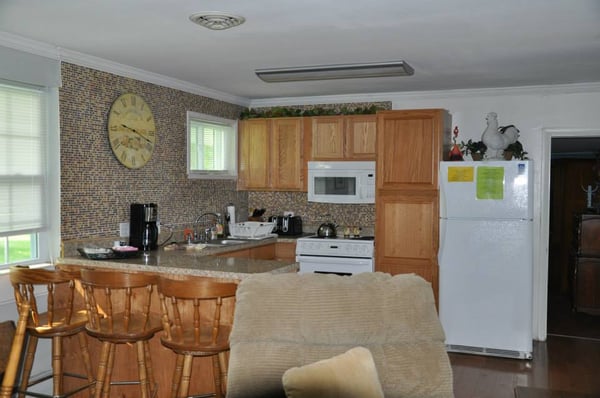
Locate an element on the screen. The width and height of the screenshot is (600, 398). kitchen is located at coordinates (294, 231).